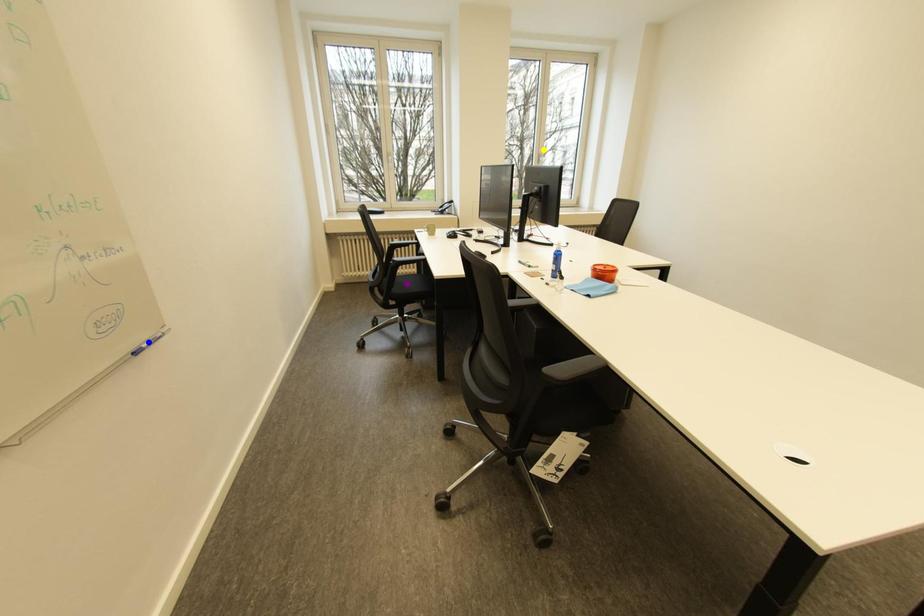
Order these from nearest to farthest:
- blue point
- purple point
- yellow point

1. yellow point
2. purple point
3. blue point